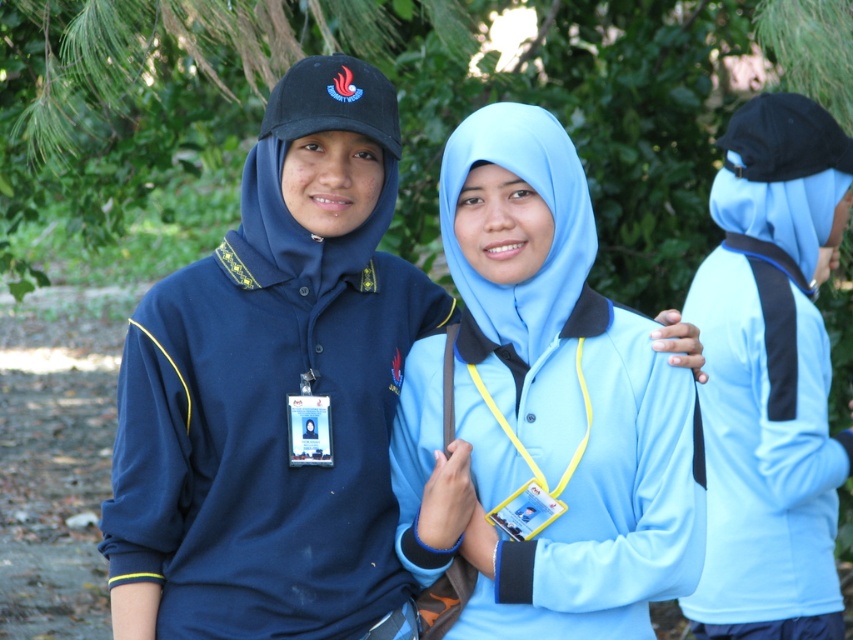
Question: Which is nearer to the light blue fabric at right?

Choices:
 (A) matte blue hoodie at center
 (B) light blue fabric hijab at center

Answer: (B)

Question: Observing the image, what is the correct spatial positioning of matte blue hoodie at center in reference to light blue fabric at right?

Choices:
 (A) left
 (B) right

Answer: (A)

Question: Is matte blue hoodie at center positioned before light blue fabric at right?

Choices:
 (A) no
 (B) yes

Answer: (B)

Question: Which is farther from the matte blue hoodie at center?

Choices:
 (A) light blue fabric at right
 (B) light blue fabric hijab at center

Answer: (A)

Question: Based on their relative distances, which object is nearer to the light blue fabric at right?

Choices:
 (A) light blue fabric hijab at center
 (B) matte blue hoodie at center

Answer: (A)

Question: Can you confirm if matte blue hoodie at center is positioned to the left of light blue fabric at right?

Choices:
 (A) yes
 (B) no

Answer: (A)